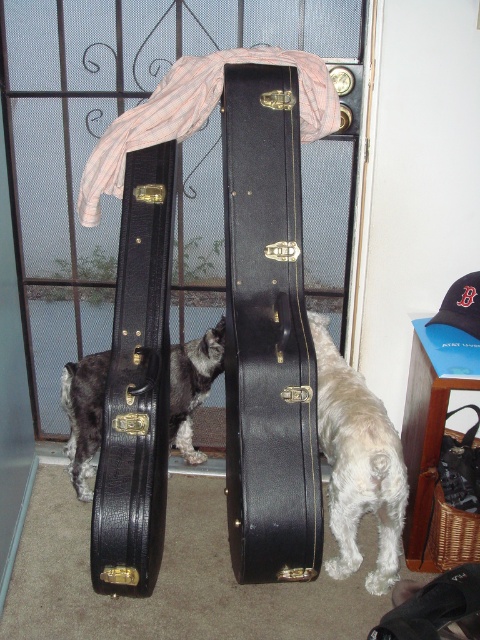
Who is higher up, black leather guitar case at left or shaggy white dog at center?

black leather guitar case at left is higher up.

Does point (155, 513) lie in front of point (169, 444)?

Yes, point (155, 513) is in front of point (169, 444).

Identify the location of black leather guitar case at left. The image size is (480, 640). (136, 387).

Between black leather guitar case at center and white fluffy dog at lower right, which one is positioned higher?

black leather guitar case at center is above.

Can you confirm if black leather guitar case at center is bigger than white fluffy dog at lower right?

Correct, black leather guitar case at center is larger in size than white fluffy dog at lower right.

Between point (227, 416) and point (350, 396), which one is positioned in front?

Positioned in front is point (350, 396).

This screenshot has height=640, width=480. Identify the location of black leather guitar case at center. (267, 333).

This screenshot has width=480, height=640. Identify the location of black leather guitar case at center. (267, 333).

Is black leather guitar case at center thinner than black leather guitar case at left?

In fact, black leather guitar case at center might be wider than black leather guitar case at left.

The image size is (480, 640). Find the location of `black leather guitar case at center`. black leather guitar case at center is located at coordinates (267, 333).

Where is `black leather guitar case at center`? This screenshot has height=640, width=480. black leather guitar case at center is located at coordinates (267, 333).